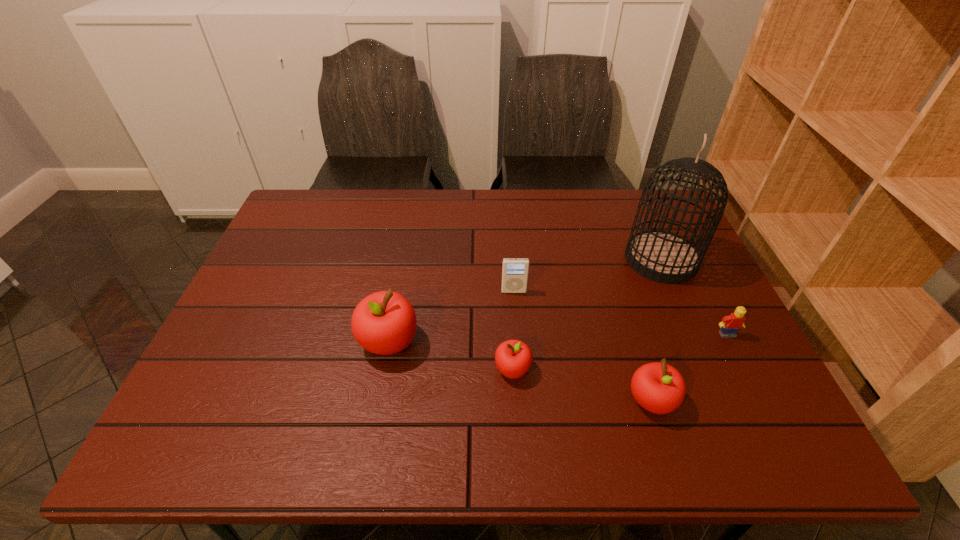
You are a GUI agent. You are given a task and a screenshot of the screen. Output one action in this format:
    pyautogui.click(x=<x>, y=<y>)
    Task: Click on the blank space located 0.260m on the left of the second tallest apple
    
    Given the screenshot: What is the action you would take?
    pyautogui.click(x=506, y=401)

Identify the location of blank area located on the front of the birdcage. (701, 349).

In order to click on vacant region located 0.280m on the front-facing side of the fifth nearest object in this screenshot , I will do `click(521, 384)`.

The image size is (960, 540). Find the location of `free location located 0.170m on the front-facing side of the Lego`. free location located 0.170m on the front-facing side of the Lego is located at coordinates (760, 401).

Image resolution: width=960 pixels, height=540 pixels. I want to click on birdcage located at the right edge, so [661, 256].

Where is `Lego that is at the right edge`? Image resolution: width=960 pixels, height=540 pixels. Lego that is at the right edge is located at coordinates (730, 324).

Image resolution: width=960 pixels, height=540 pixels. In order to click on vacant space at the far edge in this screenshot , I will do `click(456, 211)`.

Where is `vacant space at the near edge of the desktop`? This screenshot has height=540, width=960. vacant space at the near edge of the desktop is located at coordinates [420, 392].

This screenshot has width=960, height=540. In the image, there is a desktop. Identify the location of vacant space at the right edge. (666, 305).

In the image, there is a desktop. Where is `vacant space at the far left corner`? This screenshot has height=540, width=960. vacant space at the far left corner is located at coordinates click(x=302, y=198).